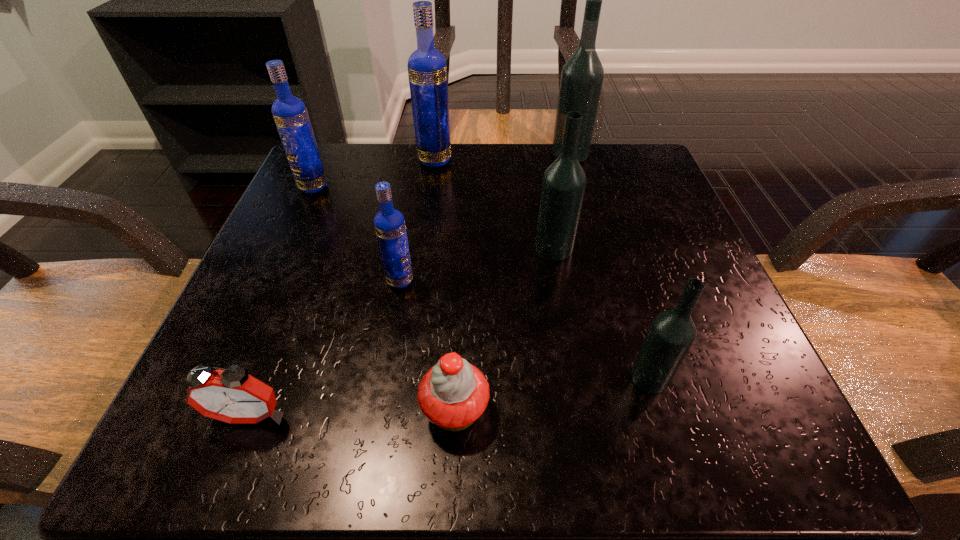
The height and width of the screenshot is (540, 960). What are the coordinates of `the biggest blue vodka` in the screenshot? It's located at (427, 70).

Locate an element on the screen. The width and height of the screenshot is (960, 540). the biggest black vodka is located at coordinates (582, 75).

Where is `the sixth nearest object`? This screenshot has width=960, height=540. the sixth nearest object is located at coordinates (290, 114).

At what (x,y) coordinates should I click in order to perform the action: click on the leftmost vodka. Please return your answer as a coordinate pair (x, y). The height and width of the screenshot is (540, 960). Looking at the image, I should click on (290, 114).

I want to click on the second nearest black vodka, so click(x=564, y=181).

Where is `the fifth nearest object`? The height and width of the screenshot is (540, 960). the fifth nearest object is located at coordinates (564, 181).

Identify the location of the fourth nearest object. (389, 223).

Identify the location of the smallest blue vodka. (389, 223).

Locate an element on the screen. the nearest vodka is located at coordinates (671, 334).

Where is `the smallest black vodka`? the smallest black vodka is located at coordinates (671, 334).